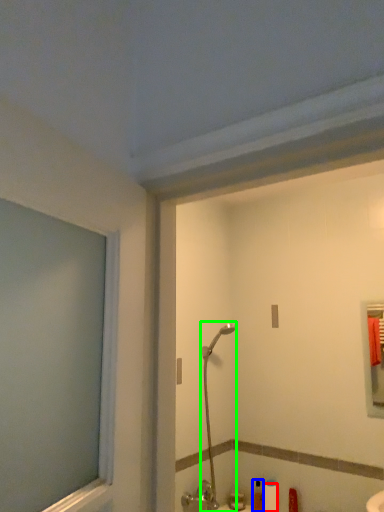
Question: Which is nearer to the toilet paper (highlighted by a red box)? toiletry (highlighted by a blue box) or shower (highlighted by a green box).

Choices:
 (A) toiletry
 (B) shower

Answer: (A)